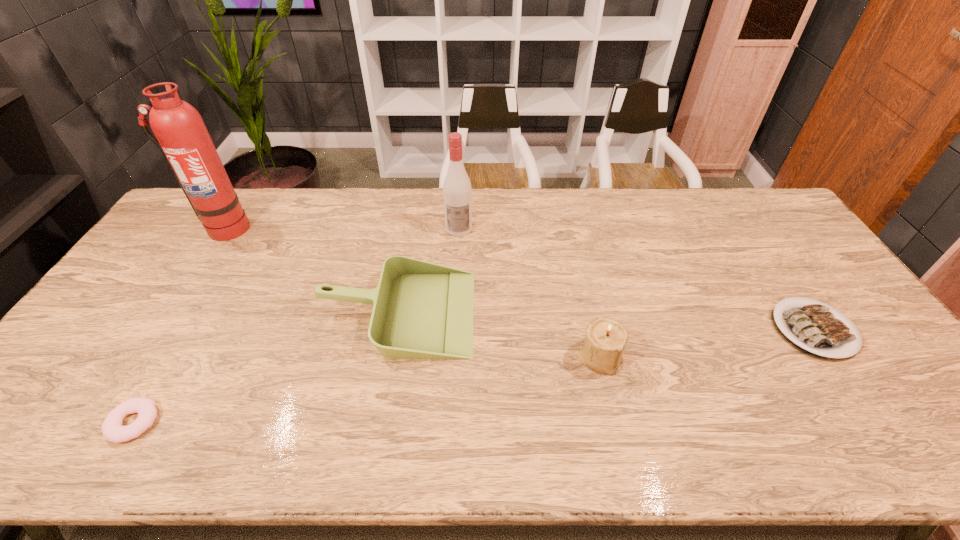
Image resolution: width=960 pixels, height=540 pixels. I want to click on free space located on the scoop of the dustpan, so click(x=519, y=312).

The width and height of the screenshot is (960, 540). Identify the location of free spot located 0.250m on the back of the plate. (754, 240).

Locate an element on the screen. This screenshot has height=540, width=960. vacant point located 0.380m on the back of the nearest object is located at coordinates (215, 286).

The height and width of the screenshot is (540, 960). Find the location of `fire extinguisher situated at the far edge`. fire extinguisher situated at the far edge is located at coordinates (181, 135).

What are the coordinates of `alcohol that is at the far edge` in the screenshot? It's located at (457, 192).

This screenshot has width=960, height=540. Find the location of `object positioned at the near edge`. object positioned at the near edge is located at coordinates (113, 431).

You are a GUI agent. You are given a task and a screenshot of the screen. Output one action in this format:
    pyautogui.click(x=<x>, y=<y>)
    Task: Click on the object at the left edge
    The image size is (960, 540).
    Given the screenshot: What is the action you would take?
    pyautogui.click(x=181, y=135)

Where is `object at the right edge`? This screenshot has width=960, height=540. object at the right edge is located at coordinates (813, 329).

Find the location of a particular element. Image resolution: width=960 pixels, height=540 pixels. object at the far left corner is located at coordinates (181, 135).

The image size is (960, 540). What are the coordinates of `vacant space at the far edge` in the screenshot? It's located at 645,216.